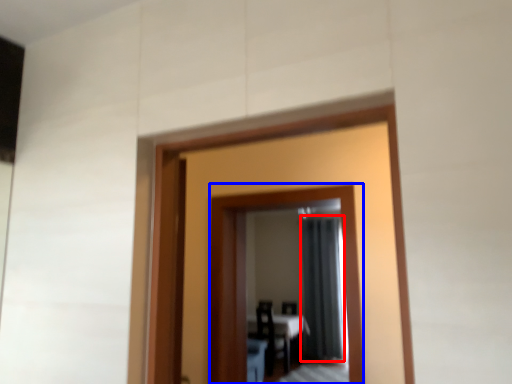
Question: Which point is further to the camera, curtain (highlighted by a red box) or mirror (highlighted by a blue box)?

Choices:
 (A) curtain
 (B) mirror

Answer: (A)